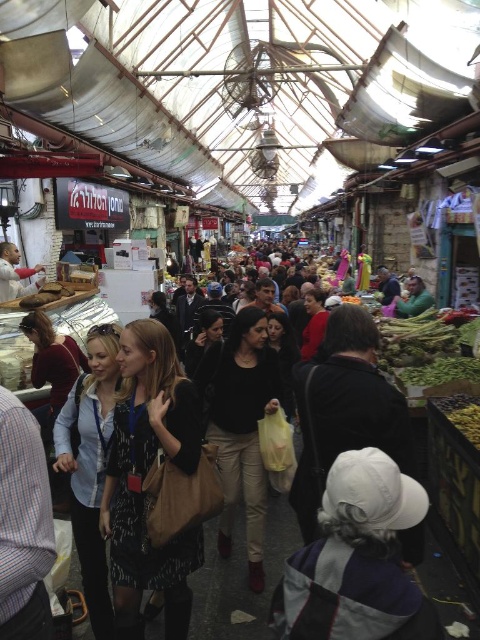
Describe the element at coordinates (240, 426) in the screenshot. I see `black matte shirt at center` at that location.

How much distance is there between black matte shirt at center and matte white shirt at center?

black matte shirt at center and matte white shirt at center are 10.77 meters apart.

Image resolution: width=480 pixels, height=640 pixels. Describe the element at coordinates (240, 426) in the screenshot. I see `black matte shirt at center` at that location.

The image size is (480, 640). I want to click on black matte shirt at center, so click(x=240, y=426).

Can you confirm if white fabric cap at lower center is bigger than black matte shirt at center?

Yes.

Is white fabric cap at lower center thinner than black matte shirt at center?

No.

Which is in front, point (368, 554) or point (215, 440)?

Point (368, 554) is in front.

Find the location of a particular element. The width and height of the screenshot is (480, 640). white fabric cap at lower center is located at coordinates (357, 560).

Can you confirm if matte blue shirt at center is positioned to the left of matte white shirt at center?

No, matte blue shirt at center is not to the left of matte white shirt at center.

Which is more to the left, matte blue shirt at center or matte white shirt at center?

Positioned to the left is matte white shirt at center.

Does point (117, 340) lie in front of point (43, 266)?

Yes, it is.

Image resolution: width=480 pixels, height=640 pixels. Identify the location of matte blue shirt at center. (91, 465).